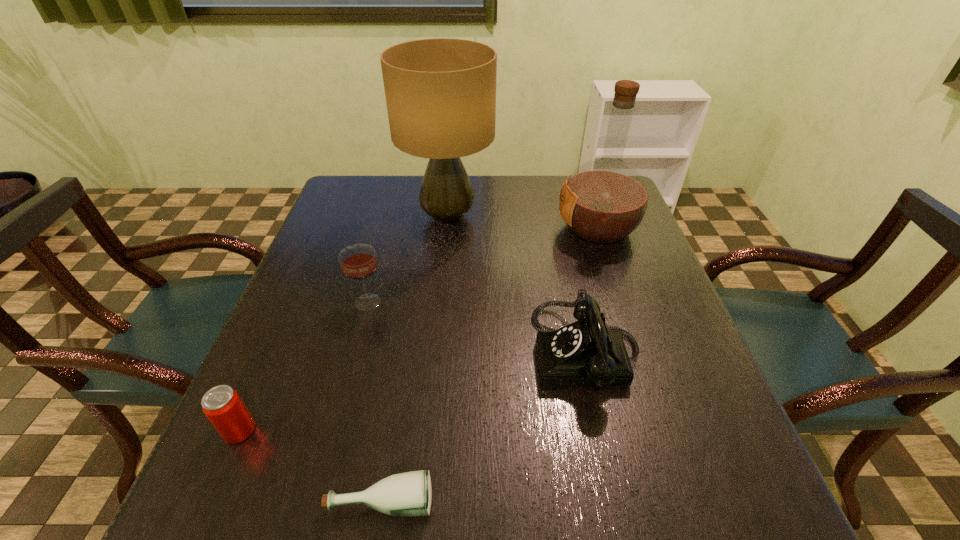
Locate an element on the screen. free region at the far left corner of the desktop is located at coordinates (376, 200).

In order to click on vacant position at the near left corner of the desktop in this screenshot , I will do `click(238, 488)`.

Locate an element on the screen. The width and height of the screenshot is (960, 540). free point between the liquor and the wineglass is located at coordinates (483, 265).

Identify the location of vacant space that's between the liquor and the telephone. This screenshot has height=540, width=960. (592, 290).

I want to click on free space between the fifth farthest object and the shortest object, so click(310, 465).

Identify the location of vacant area between the wineglass and the nearest object. This screenshot has height=540, width=960. (374, 401).

Locate an element on the screen. vacant point located between the nearest object and the wineglass is located at coordinates (374, 401).

At what (x,y) coordinates should I click in order to perform the action: click on vacant area that lies between the telephone and the lampshade. Please return your answer as a coordinate pair (x, y). Looking at the image, I should click on (517, 284).

The height and width of the screenshot is (540, 960). Find the location of `unoccupied area between the wineglass and the fifth tallest object`. unoccupied area between the wineglass and the fifth tallest object is located at coordinates (303, 366).

I want to click on vacant space in between the bottle and the wineglass, so click(x=374, y=401).